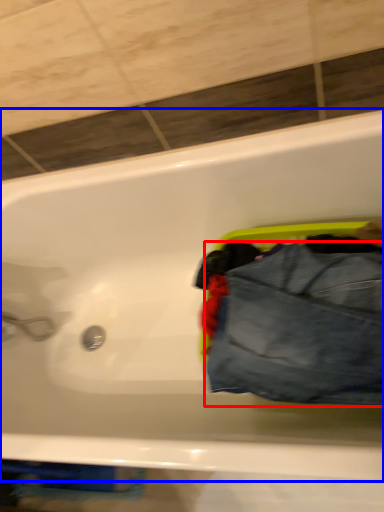
Question: Among these objects, which one is nearest to the camera, trousers (highlighted by a red box) or bathtub (highlighted by a blue box)?

Choices:
 (A) trousers
 (B) bathtub

Answer: (B)